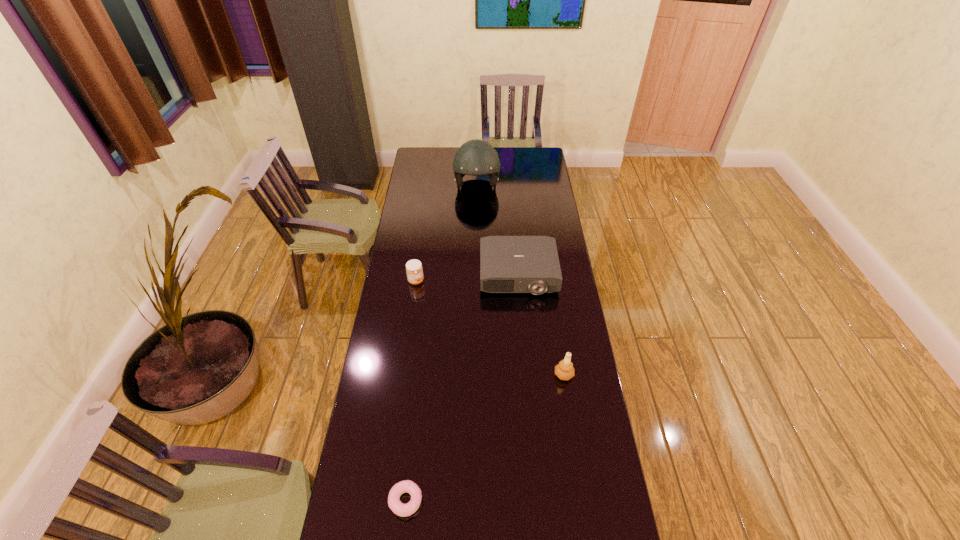
At what (x,y) coordinates should I click in order to perform the action: click on vacant space that's between the projector and the nearest object. Please return your answer as a coordinate pair (x, y). Looking at the image, I should click on (462, 388).

At what (x,y) coordinates should I click in order to perform the action: click on free spot between the projector and the nearest object. Please return your answer as a coordinate pair (x, y). Looking at the image, I should click on (462, 388).

Where is `vacant area that lies between the projector and the candle_holder`? vacant area that lies between the projector and the candle_holder is located at coordinates (541, 325).

Locate an element on the screen. The width and height of the screenshot is (960, 540). vacant area that lies between the projector and the second nearest object is located at coordinates (541, 325).

At what (x,y) coordinates should I click in order to perform the action: click on free space between the candle_holder and the jam. Please return your answer as a coordinate pair (x, y). Image resolution: width=960 pixels, height=540 pixels. Looking at the image, I should click on (490, 328).

At what (x,y) coordinates should I click in order to perform the action: click on empty space that is in between the shortest object and the projector. Please return your answer as a coordinate pair (x, y). The height and width of the screenshot is (540, 960). Looking at the image, I should click on (462, 388).

Image resolution: width=960 pixels, height=540 pixels. I want to click on free point between the jam and the fourth shortest object, so click(x=490, y=328).

Locate an element on the screen. unoccupied area between the nearest object and the tallest object is located at coordinates (442, 344).

This screenshot has width=960, height=540. Identify the location of free area in between the doughnut and the fourth shortest object. (485, 437).

Point out which object is positioned as the nearest to the projector. Please provide its 2D coordinates. Your answer should be formatted as a tuple, i.e. [(x, y)], where the tuple contains the x and y coordinates of a point satisfying the conditions above.

[(414, 269)]